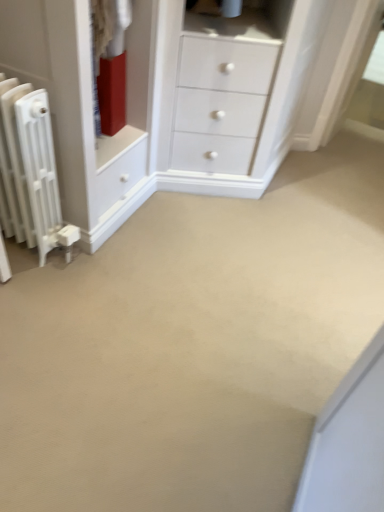
Identify the location of vacant area that lies to the right of white matte radiator at left. (99, 269).